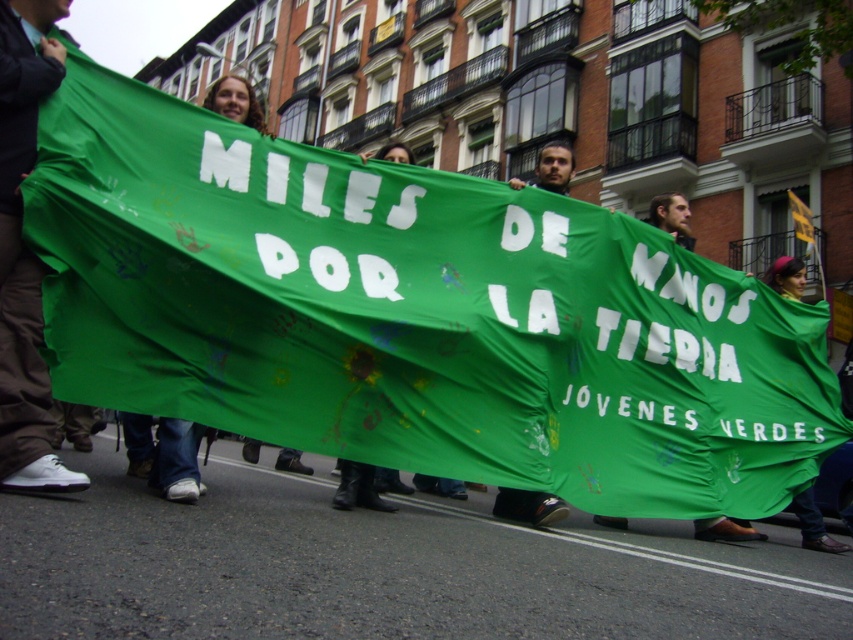
Is point (6, 10) farther from viewer compared to point (357, 464)?

That is False.

Does white matte shoe at lower left have a smaller size compared to green fabric banner at center?

Yes.

Measure the distance between white matte shoe at lower left and camera.

3.95 meters

Image resolution: width=853 pixels, height=640 pixels. I want to click on white matte shoe at lower left, so click(x=24, y=252).